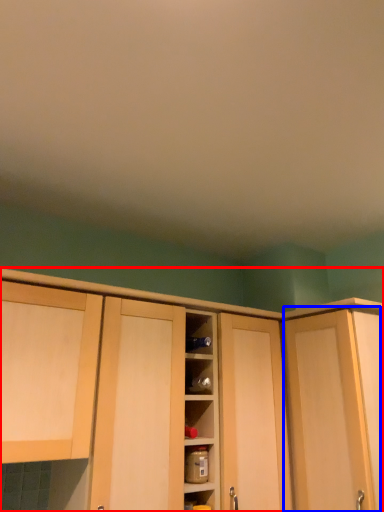
Question: Which point is further to the camera, cabinetry (highlighted by a red box) or door (highlighted by a blue box)?

Choices:
 (A) cabinetry
 (B) door

Answer: (B)